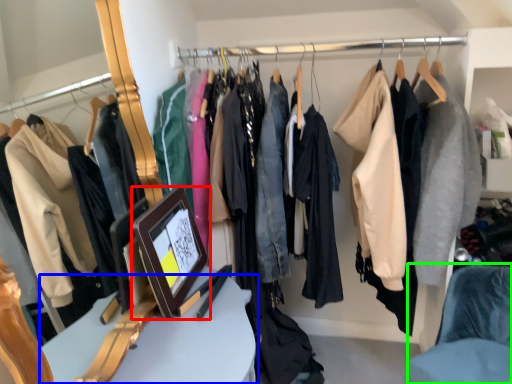
Question: Which is farther away from picture frame (highlighted by a red box)? furniture (highlighted by a blue box) or chair (highlighted by a green box)?

Choices:
 (A) furniture
 (B) chair

Answer: (B)